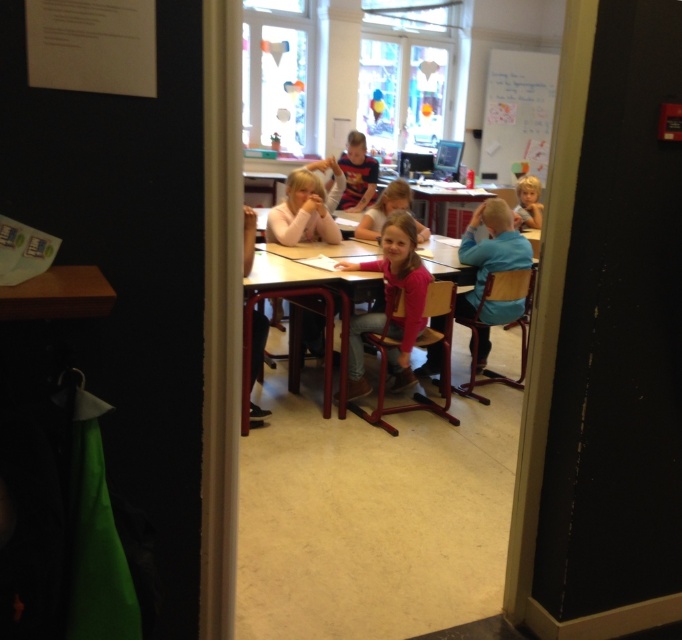
You are a teacher entering the classroom through the doorway. You need to write an important note for the students. Which object should you use, the whiteboard at upper right or the wooden table at center, and why?

You should use the whiteboard at upper right because it is larger in size than the wooden table at center, providing more space to write the important note.

You are a teacher standing at the doorway of the classroom. You need to write something on the whiteboard at upper right and also check on the pink fabric shirt at center. Which object will you reach first as you move forward into the room?

You will reach the whiteboard at upper right first because it is closer to you than the pink fabric shirt at center, which is further away.